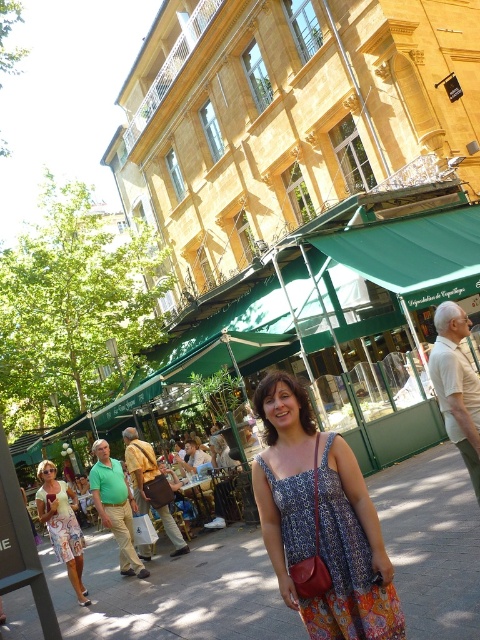
Question: Can you confirm if concrete pavement at center is positioned to the right of floral print fabric dress at lower left?

Choices:
 (A) yes
 (B) no

Answer: (A)

Question: Is concrete pavement at center positioned behind floral print fabric dress at lower left?

Choices:
 (A) no
 (B) yes

Answer: (A)

Question: Does green fabric umbrella at center have a greater width compared to floral print fabric dress at lower left?

Choices:
 (A) yes
 (B) no

Answer: (A)

Question: Which is nearer to the blue printed dress at center?

Choices:
 (A) printed fabric dress at lower left
 (B) floral print fabric dress at lower left
 (C) concrete pavement at center

Answer: (C)

Question: Which object is the closest to the green fabric umbrella at center?

Choices:
 (A) printed fabric dress at lower left
 (B) floral print fabric dress at lower left

Answer: (B)

Question: Which of these objects is positioned farthest from the concrete pavement at center?

Choices:
 (A) floral print fabric dress at lower left
 (B) printed fabric dress at lower left
 (C) green fabric umbrella at center

Answer: (B)